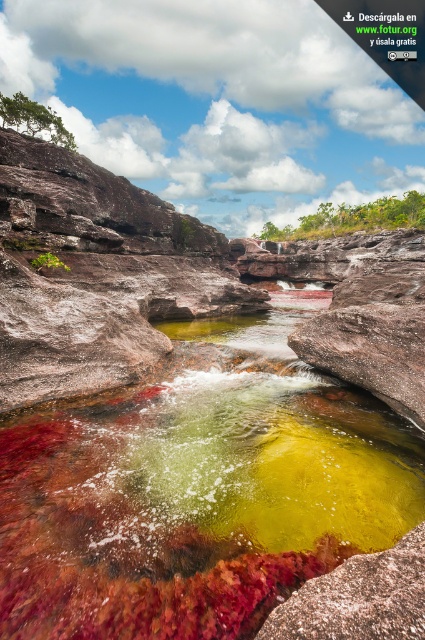
Question: Does translucent rock pool at center come behind green algae at upper center?

Choices:
 (A) no
 (B) yes

Answer: (A)

Question: Does translucent rock pool at center have a greater width compared to green algae at upper center?

Choices:
 (A) no
 (B) yes

Answer: (A)

Question: Does translucent rock pool at center have a smaller size compared to green algae at upper center?

Choices:
 (A) yes
 (B) no

Answer: (A)

Question: Among these objects, which one is farthest from the camera?

Choices:
 (A) green algae at upper center
 (B) translucent rock pool at center
 (C) smooth rock at center

Answer: (A)

Question: Which object is closer to the camera taking this photo?

Choices:
 (A) green algae at upper center
 (B) smooth rock at center

Answer: (B)

Question: Which point appears farthest from the camera in this image?

Choices:
 (A) (130, 504)
 (B) (300, 228)

Answer: (B)